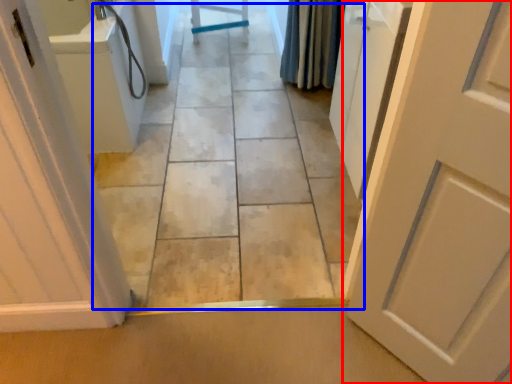
Question: Which object appears closest to the camera in this image, door (highlighted by a red box) or path (highlighted by a blue box)?

Choices:
 (A) door
 (B) path

Answer: (A)